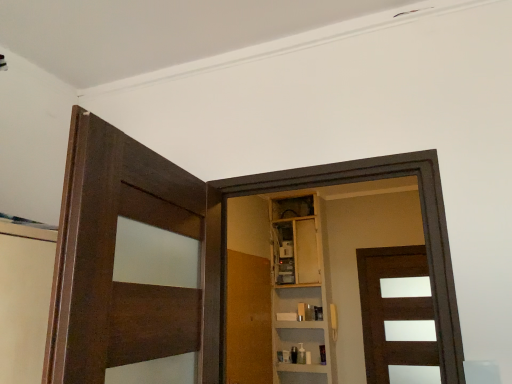
Describe the element at coordinates (114, 255) in the screenshot. I see `dark wood door at left, arranged as the first door when viewed from the front` at that location.

What do you see at coordinates (248, 320) in the screenshot? Image resolution: width=512 pixels, height=384 pixels. I see `wooden door at center, marked as the 2th door in a left-to-right arrangement` at bounding box center [248, 320].

At what (x,y) coordinates should I click in order to perform the action: click on dark wood door at left, the first door viewed from the left. Please return your answer as a coordinate pair (x, y). The height and width of the screenshot is (384, 512). Looking at the image, I should click on (114, 255).

Which object is wider, wooden cabinet at center or brown matte door at center, which appears as the 1th door when viewed from the back?

wooden cabinet at center.

Is wooden cabinet at center far from brown matte door at center, the 1th door positioned from the right?

No.

How much distance is there between wooden cabinet at center and brown matte door at center, which appears as the 1th door when viewed from the back?

21.52 inches.

Image resolution: width=512 pixels, height=384 pixels. In order to click on the 2nd door in front of the brown matte door at center, which appears as the 1th door when viewed from the back in this screenshot , I will do `click(114, 255)`.

Which is in front, dark wood door at left, placed as the third door when sorted from right to left, or brown matte door at center, acting as the third door starting from the front?

dark wood door at left, placed as the third door when sorted from right to left.

Considering the positions of point (132, 216) and point (423, 319), is point (132, 216) closer or farther from the camera than point (423, 319)?

Point (132, 216).

Is dark wood door at left, arranged as the first door when viewed from the front, next to brown matte door at center, which appears as the 1th door when viewed from the back, and touching it?

There is a gap between dark wood door at left, arranged as the first door when viewed from the front, and brown matte door at center, which appears as the 1th door when viewed from the back.

Is wooden door at center, marked as the 2th door in a left-to-right arrangement, inside or outside of wooden cabinet at center?

wooden door at center, marked as the 2th door in a left-to-right arrangement, cannot be found inside wooden cabinet at center.

Considering the sizes of wooden door at center, which appears as the second door when viewed from the back, and wooden cabinet at center in the image, is wooden door at center, which appears as the second door when viewed from the back, taller or shorter than wooden cabinet at center?

Considering their sizes, wooden door at center, which appears as the second door when viewed from the back, has less height than wooden cabinet at center.

What's the angular difference between wooden door at center, which ranks as the 2th door in right-to-left order, and wooden cabinet at center's facing directions?

wooden door at center, which ranks as the 2th door in right-to-left order, and wooden cabinet at center are facing 91 degrees away from each other.

In the image, is wooden door at center, which ranks as the 2th door in right-to-left order, positioned in front of or behind wooden cabinet at center?

In the image, wooden door at center, which ranks as the 2th door in right-to-left order, appears in front of wooden cabinet at center.

Would you say wooden cabinet at center is part of dark wood door at left, which is the 3th door from back to front,'s contents?

No, dark wood door at left, which is the 3th door from back to front, does not contain wooden cabinet at center.

Is wooden cabinet at center at the back of dark wood door at left, placed as the third door when sorted from right to left?

Correct, dark wood door at left, placed as the third door when sorted from right to left, is looking away from wooden cabinet at center.

Is dark wood door at left, arranged as the first door when viewed from the front, not close to wooden cabinet at center?

Yes, dark wood door at left, arranged as the first door when viewed from the front, is far from wooden cabinet at center.

Where is `cabinetry located below the dark wood door at left, placed as the third door when sorted from right to left (from the image's perspective)`? This screenshot has height=384, width=512. cabinetry located below the dark wood door at left, placed as the third door when sorted from right to left (from the image's perspective) is located at coordinates (301, 290).

Does wooden door at center, which appears as the second door when viewed from the back, lie behind dark wood door at left, placed as the third door when sorted from right to left?

Yes, the depth of wooden door at center, which appears as the second door when viewed from the back, is greater than that of dark wood door at left, placed as the third door when sorted from right to left.

From a real-world perspective, who is located higher, wooden door at center, the 2th door when ordered from front to back, or dark wood door at left, which is the 3th door from back to front?

dark wood door at left, which is the 3th door from back to front, from a real-world perspective.

From the picture: Between wooden door at center, the 2th door when ordered from front to back, and dark wood door at left, the first door viewed from the left, which one appears on the right side from the viewer's perspective?

wooden door at center, the 2th door when ordered from front to back, is more to the right.

Is wooden door at center, which ranks as the 2th door in right-to-left order, looking in the opposite direction of dark wood door at left, arranged as the first door when viewed from the front?

No, wooden door at center, which ranks as the 2th door in right-to-left order,'s orientation is not away from dark wood door at left, arranged as the first door when viewed from the front.

In the scene shown: Which object is positioned more to the right, brown matte door at center, the 3th door viewed from the left, or wooden cabinet at center?

From the viewer's perspective, brown matte door at center, the 3th door viewed from the left, appears more on the right side.

Which is correct: brown matte door at center, the 3th door viewed from the left, is inside wooden cabinet at center, or outside of it?

brown matte door at center, the 3th door viewed from the left, is outside wooden cabinet at center.

Image resolution: width=512 pixels, height=384 pixels. What are the coordinates of `cabinetry on the left of brown matte door at center, the 3th door viewed from the left` in the screenshot? It's located at (301, 290).

Considering the positions of points (367, 308) and (323, 257), is point (367, 308) closer to camera compared to point (323, 257)?

That is True.

Are wooden cabinet at center and wooden door at center, the 2th door when ordered from front to back, located far from each other?

No, there isn't a large distance between wooden cabinet at center and wooden door at center, the 2th door when ordered from front to back.

From the image's perspective, is wooden cabinet at center positioned above or below wooden door at center, the 2th door when ordered from front to back?

Clearly, from the image's perspective, wooden cabinet at center is above wooden door at center, the 2th door when ordered from front to back.

Is wooden cabinet at center in front of or behind wooden door at center, marked as the 2th door in a left-to-right arrangement, in the image?

Clearly, wooden cabinet at center is behind wooden door at center, marked as the 2th door in a left-to-right arrangement.

Considering the sizes of objects wooden cabinet at center and wooden door at center, the 2th door when ordered from front to back, in the image provided, who is taller, wooden cabinet at center or wooden door at center, the 2th door when ordered from front to back,?

wooden cabinet at center.

In order to click on the 2nd door positioned below the wooden cabinet at center (from the image's perspective) in this screenshot , I will do `click(397, 316)`.

There is a brown matte door at center, acting as the third door starting from the front. Where is `the 2nd door above it (from a real-world perspective)`? This screenshot has width=512, height=384. the 2nd door above it (from a real-world perspective) is located at coordinates (114, 255).

Considering their positions, is wooden door at center, which ranks as the 2th door in right-to-left order, positioned closer to wooden cabinet at center than dark wood door at left, placed as the third door when sorted from right to left?

The object closer to wooden cabinet at center is wooden door at center, which ranks as the 2th door in right-to-left order.

From the image, which object appears to be nearer to wooden cabinet at center, brown matte door at center, acting as the third door starting from the front, or wooden door at center, the 2th door when ordered from front to back?

wooden door at center, the 2th door when ordered from front to back, lies closer to wooden cabinet at center than the other object.

Looking at the image, which one is located closer to wooden door at center, marked as the 2th door in a left-to-right arrangement, brown matte door at center, which appears as the 1th door when viewed from the back, or wooden cabinet at center?

wooden cabinet at center is closer to wooden door at center, marked as the 2th door in a left-to-right arrangement.

Considering their positions, is wooden cabinet at center positioned further to dark wood door at left, placed as the third door when sorted from right to left, than brown matte door at center, acting as the third door starting from the front?

brown matte door at center, acting as the third door starting from the front, is positioned further to the anchor dark wood door at left, placed as the third door when sorted from right to left.

From the image, which object appears to be farther from wooden door at center, which appears as the second door when viewed from the back, dark wood door at left, arranged as the first door when viewed from the front, or brown matte door at center, acting as the third door starting from the front?

dark wood door at left, arranged as the first door when viewed from the front, is further to wooden door at center, which appears as the second door when viewed from the back.

Based on their spatial positions, is brown matte door at center, acting as the third door starting from the front, or dark wood door at left, the first door viewed from the left, closer to wooden door at center, marked as the 2th door in a left-to-right arrangement?

Among the two, brown matte door at center, acting as the third door starting from the front, is located nearer to wooden door at center, marked as the 2th door in a left-to-right arrangement.

Based on their spatial positions, is brown matte door at center, the 1th door positioned from the right, or wooden cabinet at center closer to dark wood door at left, which is the 3th door from back to front?

Among the two, wooden cabinet at center is located nearer to dark wood door at left, which is the 3th door from back to front.

From the image, which object appears to be farther from brown matte door at center, acting as the third door starting from the front, wooden door at center, which appears as the second door when viewed from the back, or wooden cabinet at center?

The object further to brown matte door at center, acting as the third door starting from the front, is wooden door at center, which appears as the second door when viewed from the back.

Identify the location of door between dark wood door at left, placed as the third door when sorted from right to left, and brown matte door at center, which appears as the 1th door when viewed from the back, along the z-axis. The image size is (512, 384). (248, 320).

Locate an element on the screen. The height and width of the screenshot is (384, 512). cabinetry between wooden door at center, which appears as the second door when viewed from the back, and brown matte door at center, the 1th door positioned from the right, from left to right is located at coordinates (301, 290).